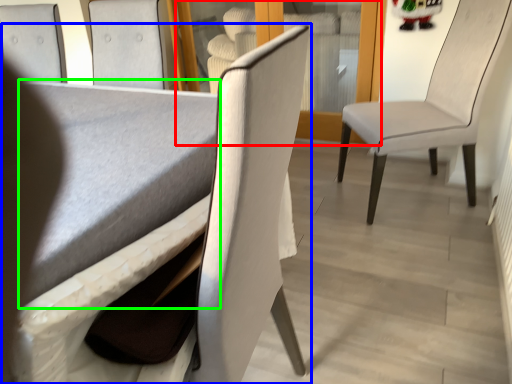
Question: Which object is the closest to the glass door (highlighted by a red box)? Choose among these: chair (highlighted by a blue box) or table (highlighted by a green box).

Choices:
 (A) chair
 (B) table

Answer: (B)